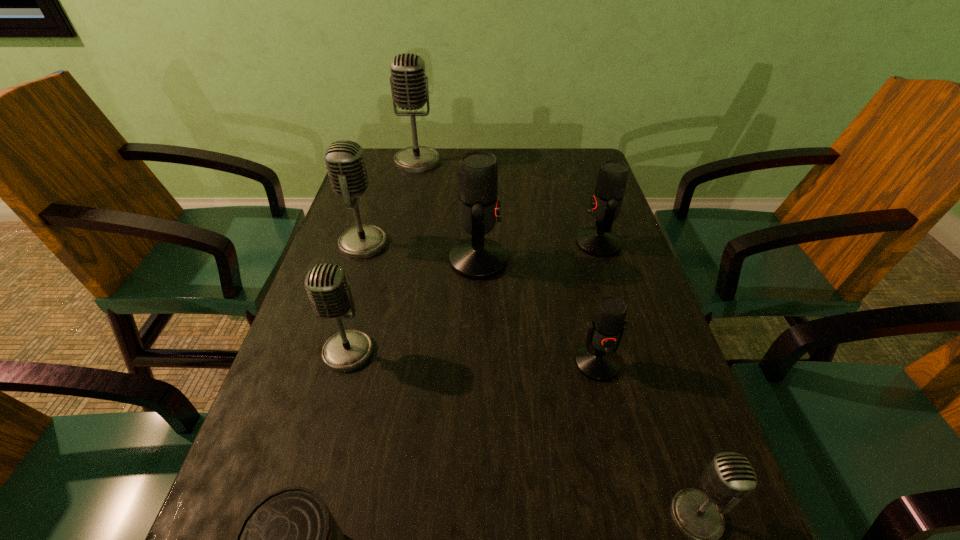
You are a GUI agent. You are given a task and a screenshot of the screen. Output one action in this format:
    pyautogui.click(x=<x>, y=<y>)
    Task: Click on the vacant space located on the front of the third smallest gray microphone
    
    Given the screenshot: What is the action you would take?
    pyautogui.click(x=343, y=310)

Find the location of `vacant space located on the side of the second biggest red microphone with the red ring`. vacant space located on the side of the second biggest red microphone with the red ring is located at coordinates (500, 243).

Where is `free region located 0.150m on the side of the second biggest red microphone with the red ring`? The width and height of the screenshot is (960, 540). free region located 0.150m on the side of the second biggest red microphone with the red ring is located at coordinates (516, 243).

Locate an element on the screen. This screenshot has width=960, height=540. vacant space located on the side of the second biggest red microphone with the red ring is located at coordinates (496, 243).

Find the location of `vacant space located on the back of the second smallest gray microphone`. vacant space located on the back of the second smallest gray microphone is located at coordinates (364, 294).

You are a GUI agent. You are given a task and a screenshot of the screen. Output one action in this format:
    pyautogui.click(x=<x>, y=<y>)
    Task: Click on the vacant space located on the side of the smallest red microphone with the red ring
    The height and width of the screenshot is (540, 960).
    Given the screenshot: What is the action you would take?
    pyautogui.click(x=610, y=416)

Image resolution: width=960 pixels, height=540 pixels. I want to click on object that is positioned at the far edge, so click(x=409, y=85).

Identify the location of object that is positioned at the far left corner. The image size is (960, 540). (409, 85).

In the image, there is a desktop. Where is `vacant area at the left edge`? This screenshot has width=960, height=540. vacant area at the left edge is located at coordinates (385, 267).

Locate an element on the screen. The height and width of the screenshot is (540, 960). free region at the right edge of the desktop is located at coordinates (630, 254).